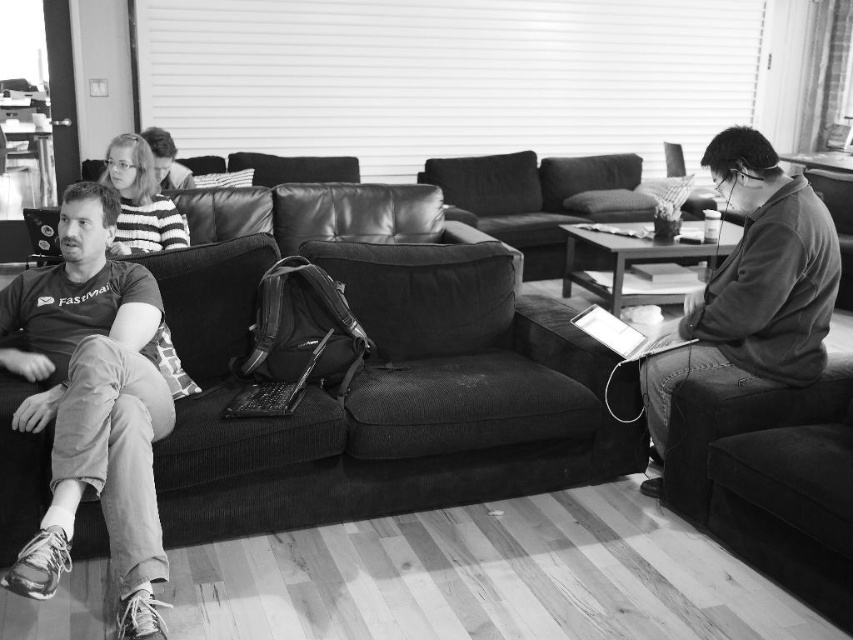
Question: From the image, what is the correct spatial relationship of soft fabric couch at center in relation to striped sweater at upper left?

Choices:
 (A) above
 (B) below

Answer: (B)

Question: Among these points, which one is nearest to the camera?

Choices:
 (A) (x=614, y=328)
 (B) (x=125, y=621)
 (C) (x=57, y=244)
 (D) (x=560, y=483)

Answer: (B)

Question: Which of the following is the farthest from the observer?

Choices:
 (A) matte gray t-shirt at left
 (B) soft leather couch at center

Answer: (B)

Question: Can you confirm if matte black laptop at center is positioned below matte black laptop at left?

Choices:
 (A) no
 (B) yes

Answer: (B)

Question: Is matte gray hoodie at right positioned at the back of soft leather couch at center?

Choices:
 (A) yes
 (B) no

Answer: (B)

Question: Which object appears closest to the camera in this image?

Choices:
 (A) matte gray t-shirt at left
 (B) metallic silver laptop at right
 (C) soft leather couch at center

Answer: (A)